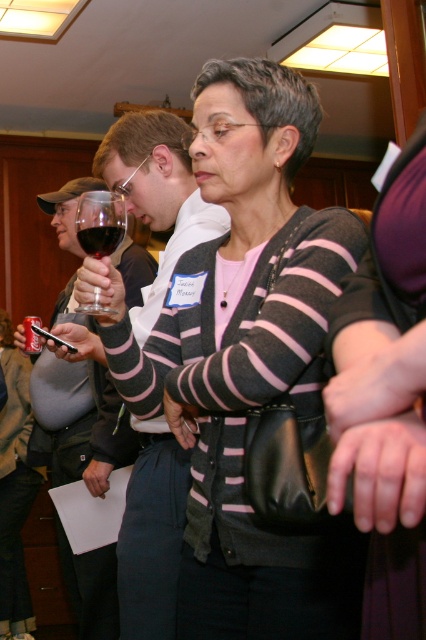
You are a bartender at a party and need to place a name tag on the person holding the matte black wine glass at left and the dark red liquid at upper left. Where should you place the name tag?

The name tag should be placed on the matte black wine glass at left since it is the object being held by the person, and the dark red liquid at upper left is inside the glass.

You are at a party and want to pour a drink into the taller glass. Which object should you choose between the matte black wine glass at left and the transparent glass at upper center?

The matte black wine glass at left is much taller than the transparent glass at upper center, so you should choose the matte black wine glass at left to pour the drink into.

You are at a party and want to grab a drink. There is a transparent glass at upper center and a dark red liquid at upper left. Which one is closer to you?

The transparent glass at upper center is closer to you because it is in front of the dark red liquid at upper left.